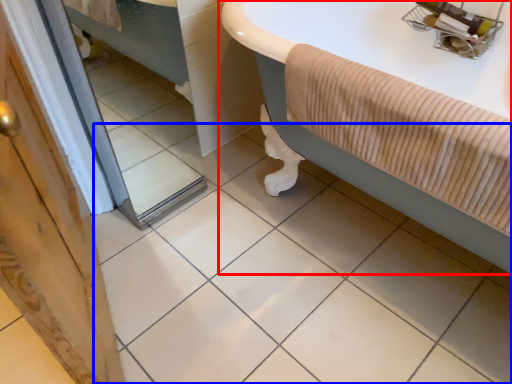
Question: Which point is further to the camera, bathtub (highlighted by a red box) or ceramic tile (highlighted by a blue box)?

Choices:
 (A) bathtub
 (B) ceramic tile

Answer: (A)